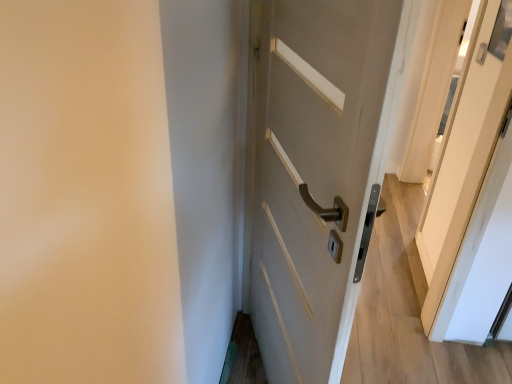
Question: Is point (284, 352) positioned closer to the camera than point (453, 261)?

Choices:
 (A) farther
 (B) closer

Answer: (B)

Question: From the image's perspective, is matte white door at center positioned above or below white glossy screen door at upper right?

Choices:
 (A) above
 (B) below

Answer: (B)

Question: Based on their sizes in the image, would you say matte white door at center is bigger or smaller than white glossy screen door at upper right?

Choices:
 (A) small
 (B) big

Answer: (B)

Question: Relative to matte white door at center, is white glossy screen door at upper right in front or behind?

Choices:
 (A) front
 (B) behind

Answer: (B)

Question: Choose the correct answer: Is white glossy screen door at upper right inside matte white door at center or outside it?

Choices:
 (A) inside
 (B) outside

Answer: (B)

Question: From a real-world perspective, is white glossy screen door at upper right positioned above or below matte white door at center?

Choices:
 (A) below
 (B) above

Answer: (A)

Question: Does point (485, 69) appear closer or farther from the camera than point (337, 74)?

Choices:
 (A) farther
 (B) closer

Answer: (A)